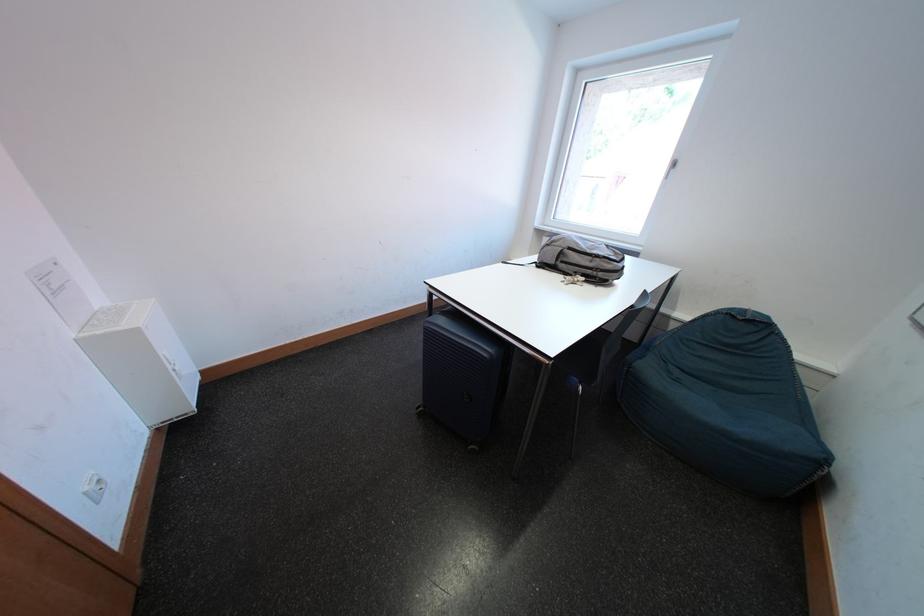
Find where to sit the chair sitting surface. Please return your answer as a coordinate pair (x, y).

(725, 418)